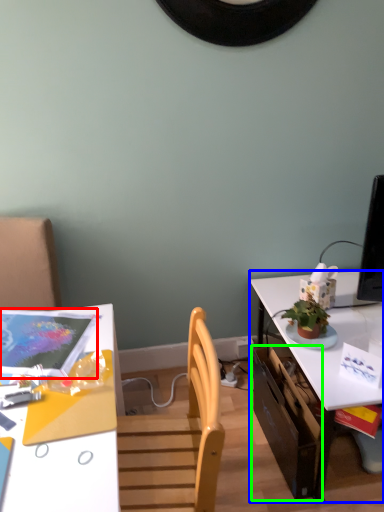
Question: Which object is positioned farthest from magazine (highlighted by a red box)? Select from table (highlighted by a blue box) and drawer (highlighted by a green box).

Choices:
 (A) table
 (B) drawer

Answer: (A)